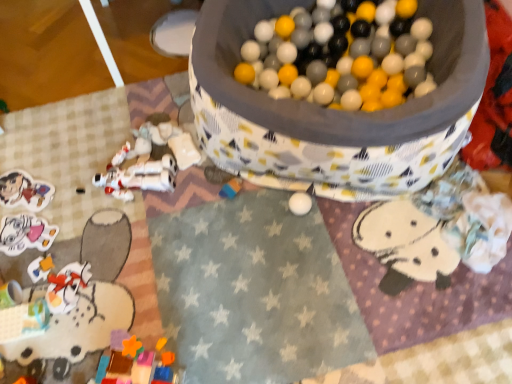
You are a GUI agent. You are given a task and a screenshot of the screen. Output one action in this format:
    pyautogui.click(x=<x>, y=<y>)
    Task: Click on the free area in between plastic toy figure at lower left, placed as the fourth toy when sorted from right to left, and fluffy white blanket at lower right, arranged as the 1th toy when viewed from the right
    
    Given the screenshot: What is the action you would take?
    pyautogui.click(x=259, y=259)